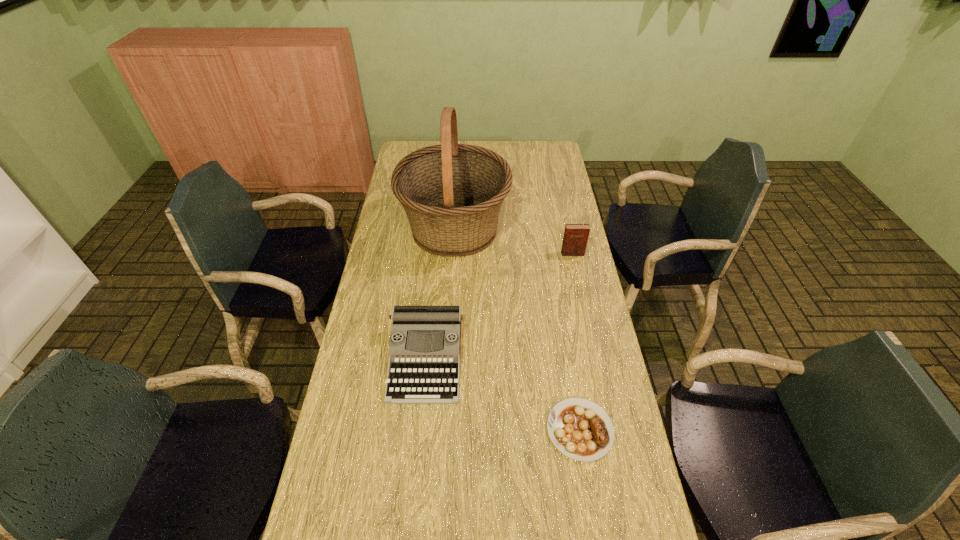
At what (x,y) coordinates should I click in order to perform the action: click on the second closest object to the typewriter. Please return your answer as a coordinate pair (x, y). Looking at the image, I should click on (452, 193).

At what (x,y) coordinates should I click in order to perform the action: click on object that is the closest one to the basket. Please return your answer as a coordinate pair (x, y). Looking at the image, I should click on (575, 239).

At what (x,y) coordinates should I click in order to perform the action: click on vacant area that satisfies the following two spatial constraints: 1. on the typing side of the typewriter; 2. on the left side of the steak. Please return your answer as a coordinate pair (x, y). Looking at the image, I should click on (420, 430).

Find the location of a particular element. free space that satisfies the following two spatial constraints: 1. on the typing side of the shortest object; 2. on the right side of the typewriter is located at coordinates (x=420, y=430).